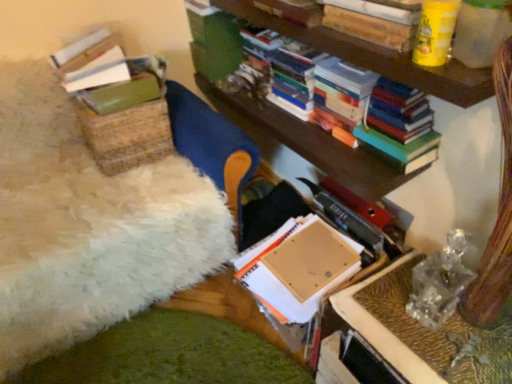
Question: Is cardboard box at center, the 1th book from the bottom, looking in the opposite direction of hardcover book at upper center, positioned as the 2th book in bottom-to-top order?

Choices:
 (A) yes
 (B) no

Answer: (B)

Question: Does cardboard box at center, arranged as the second book when viewed from the top, have a lesser height compared to hardcover book at upper center, positioned as the 2th book in bottom-to-top order?

Choices:
 (A) no
 (B) yes

Answer: (A)

Question: Does cardboard box at center, arranged as the second book when viewed from the top, appear on the left side of hardcover book at upper center, positioned as the 2th book in bottom-to-top order?

Choices:
 (A) yes
 (B) no

Answer: (B)

Question: Is cardboard box at center, the 1th book from the bottom, not within hardcover book at upper center, marked as the first book in a top-to-bottom arrangement?

Choices:
 (A) no
 (B) yes

Answer: (B)

Question: Is the position of cardboard box at center, arranged as the second book when viewed from the top, more distant than that of hardcover book at upper center, marked as the first book in a top-to-bottom arrangement?

Choices:
 (A) yes
 (B) no

Answer: (B)

Question: Does cardboard box at center, the 1th book from the bottom, have a lesser width compared to hardcover book at upper center, marked as the first book in a top-to-bottom arrangement?

Choices:
 (A) no
 (B) yes

Answer: (A)

Question: From the image's perspective, is hardcover book at upper center, positioned as the 2th book in bottom-to-top order, on top of hardcover books at upper right?

Choices:
 (A) no
 (B) yes

Answer: (B)

Question: Does hardcover book at upper center, positioned as the 2th book in bottom-to-top order, appear on the left side of hardcover books at upper right?

Choices:
 (A) no
 (B) yes

Answer: (B)

Question: Is hardcover book at upper center, positioned as the 2th book in bottom-to-top order, completely or partially outside of hardcover books at upper right?

Choices:
 (A) no
 (B) yes

Answer: (B)

Question: Is hardcover book at upper center, marked as the first book in a top-to-bottom arrangement, directly adjacent to hardcover books at upper right?

Choices:
 (A) no
 (B) yes

Answer: (A)

Question: Is hardcover book at upper center, marked as the first book in a top-to-bottom arrangement, looking in the opposite direction of hardcover books at upper right?

Choices:
 (A) yes
 (B) no

Answer: (B)

Question: Is hardcover book at upper center, marked as the first book in a top-to-bottom arrangement, smaller than hardcover books at upper right?

Choices:
 (A) no
 (B) yes

Answer: (A)

Question: Is hardcover books at upper right directly adjacent to cardboard box at center, the 1th book from the bottom?

Choices:
 (A) no
 (B) yes

Answer: (A)